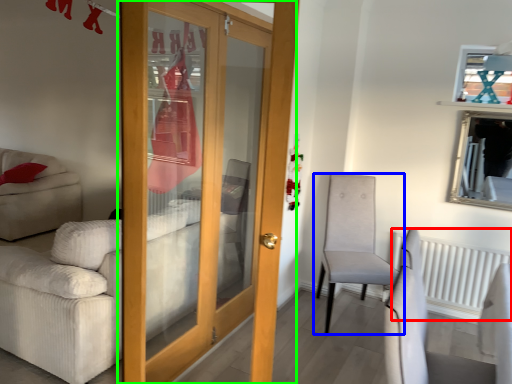
Question: Estimate the real-world distances between objects in this image. Which object is closer to radiator (highlighted by a red box), chair (highlighted by a blue box) or door (highlighted by a green box)?

Choices:
 (A) chair
 (B) door

Answer: (A)